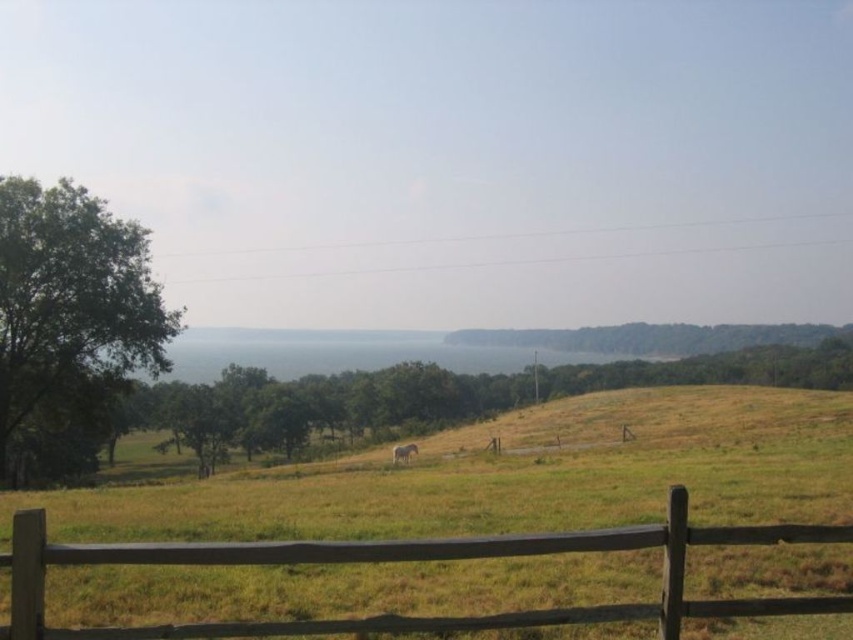
You are a photographer standing at the edge of the field near the wooden fence. You want to capture a photo of the brown textured horse at center and the green leafy tree at left in the same frame. Given that your camera has a maximum focus range of 15 meters, will both subjects be in focus?

The green leafy tree at left is 15.50 meters away from the brown textured horse at center. Since the camera can focus up to 15 meters, the distance between them exceeds the focus range. Therefore, both subjects cannot be in focus simultaneously.